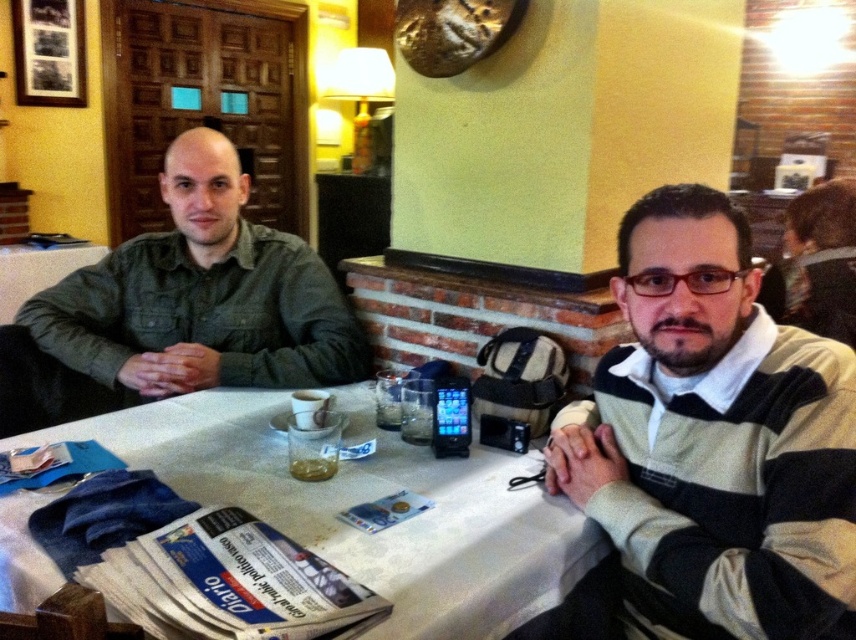
Looking at this image, you are a waiter in a restaurant and need to place a new menu between the striped sweater at center and the white textured table at center. Where should you put it to ensure it is between them according to their positions?

The striped sweater at center is in front of the white textured table at center, so placing the menu in between them would require positioning it between the striped sweater at center and the white textured table at center, ensuring it is closer to the sweater since it is in front of the table.

You are a server at the restaurant and need to place a new menu on the table. Given that the menu is 12 inches wide, will it fit on the white textured table at center compared to the green denim shirt at left?

The white textured table at center is wider than the green denim shirt at left. Since the menu is 12 inches wide, it should fit on the table as the table is wider than the shirt.

You are a waiter in a restaurant. You need to place a 30 cm wide dessert plate between the striped sweater at center and the white textured table at center. Is there enough space?

The distance between the striped sweater at center and the white textured table at center is 33.89 centimeters. Since the dessert plate is 30 cm wide, there is enough space to place it between them.